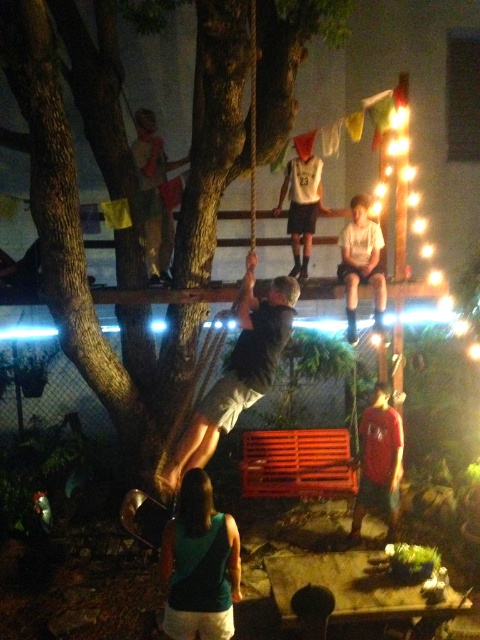
In the scene shown: What color is the clothing item located at the coordinates point (379,461)?

The clothing item at point (379,461) is a matte red t shirt.

You are organizing a small outdoor event and need to arrange seating. You have two guests wearing the teal fabric tank top at lower center and camouflage fabric shirt at upper left. Which guest requires more space for seating?

The camouflage fabric shirt at upper left requires more space for seating because it occupies more space than the teal fabric tank top at lower center.